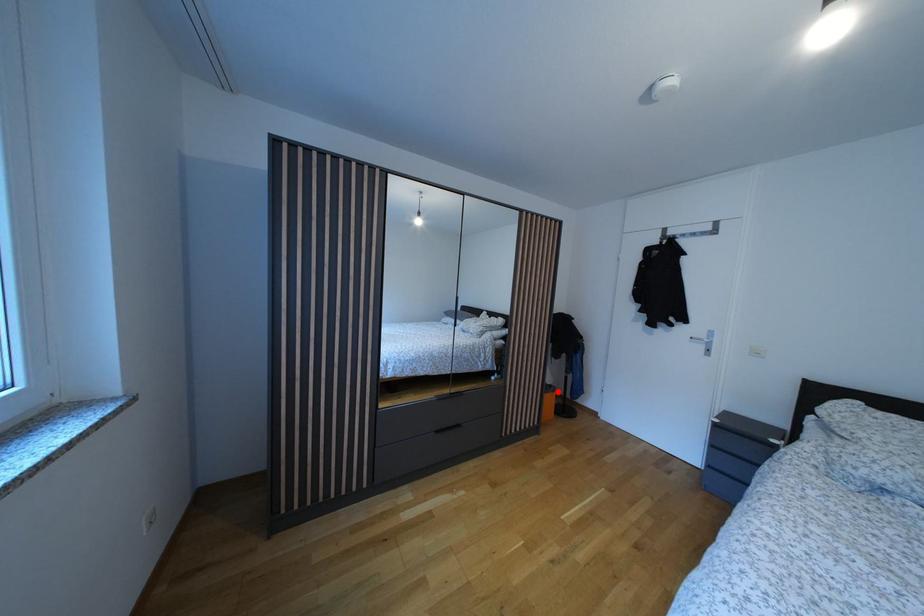
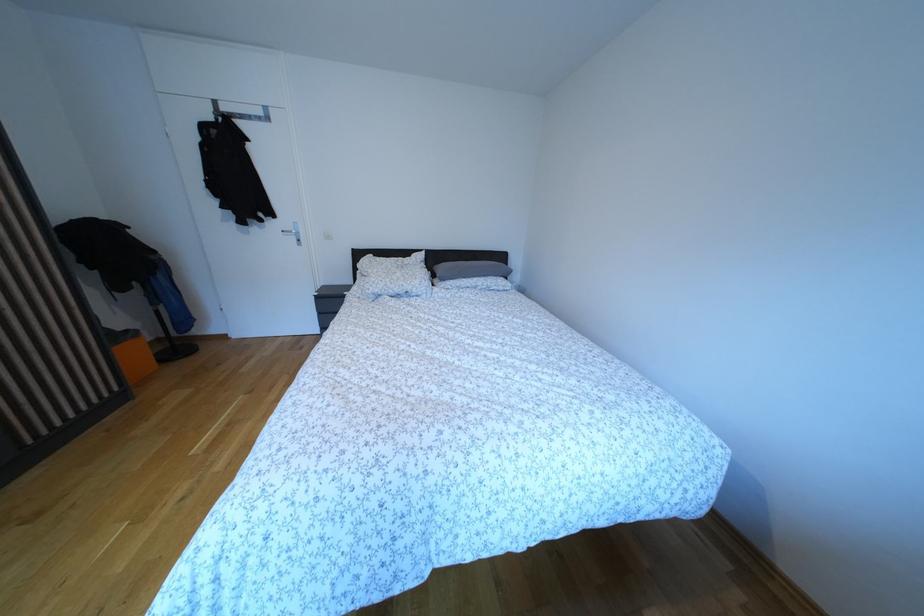
Question: I am providing you with two images of the same scene from different viewpoints. Given a red point in image1, look at the same physical point in image2. Is it:

Choices:
 (A) Closer to the viewpoint
 (B) Farther from the viewpoint

Answer: (A)